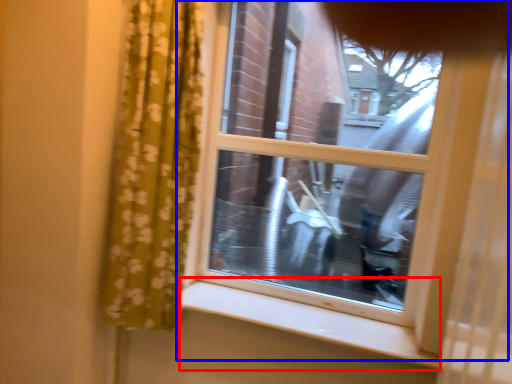
Question: Which object appears closest to the camera in this image, window sill (highlighted by a red box) or window (highlighted by a blue box)?

Choices:
 (A) window sill
 (B) window

Answer: (A)